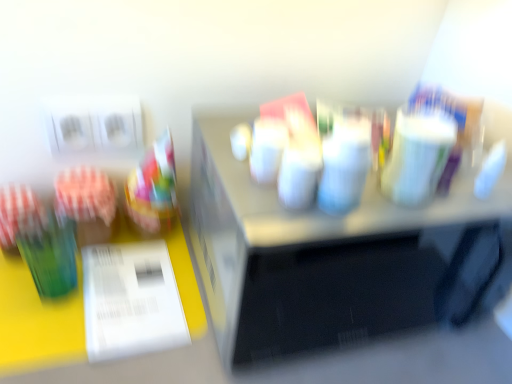
Question: Is green glass at left a part of translucent plastic cup at left?

Choices:
 (A) yes
 (B) no

Answer: (B)

Question: Is translucent plastic cup at left far from green glass at left?

Choices:
 (A) yes
 (B) no

Answer: (B)

Question: Is translucent plastic cup at left to the right of green glass at left from the viewer's perspective?

Choices:
 (A) no
 (B) yes

Answer: (B)

Question: Is translucent plastic cup at left positioned in front of green glass at left?

Choices:
 (A) no
 (B) yes

Answer: (B)

Question: From the image's perspective, is translucent plastic cup at left on green glass at left?

Choices:
 (A) no
 (B) yes

Answer: (B)

Question: Can you confirm if translucent plastic cup at left is bigger than green glass at left?

Choices:
 (A) no
 (B) yes

Answer: (B)

Question: Is metallic silver microwave at center smaller than translucent plastic cup at left?

Choices:
 (A) no
 (B) yes

Answer: (A)

Question: Considering the relative positions of metallic silver microwave at center and translucent plastic cup at left in the image provided, is metallic silver microwave at center behind translucent plastic cup at left?

Choices:
 (A) yes
 (B) no

Answer: (B)

Question: Is metallic silver microwave at center touching translucent plastic cup at left?

Choices:
 (A) no
 (B) yes

Answer: (A)

Question: From the image's perspective, is metallic silver microwave at center beneath translucent plastic cup at left?

Choices:
 (A) yes
 (B) no

Answer: (A)

Question: From the image's perspective, is metallic silver microwave at center on top of translucent plastic cup at left?

Choices:
 (A) yes
 (B) no

Answer: (B)

Question: Would you say metallic silver microwave at center is outside translucent plastic cup at left?

Choices:
 (A) no
 (B) yes

Answer: (B)

Question: From the image's perspective, does metallic silver microwave at center appear higher than white glossy paper at lower left?

Choices:
 (A) no
 (B) yes

Answer: (B)